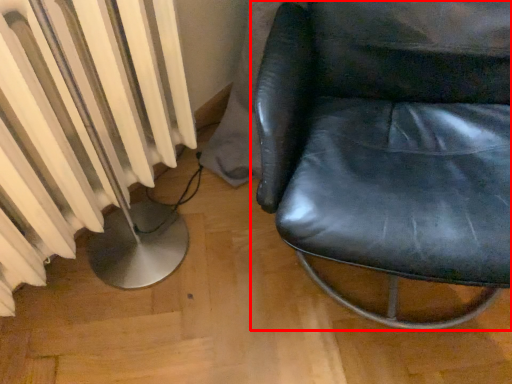
Question: From the image's perspective, what is the correct spatial positioning of chair (annotated by the red box) in reference to radiator?

Choices:
 (A) above
 (B) below

Answer: (A)